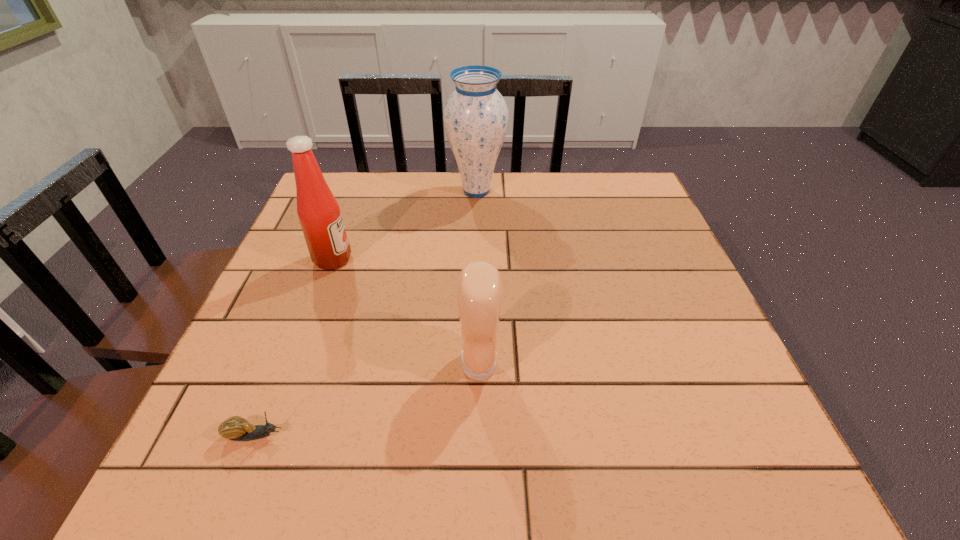
You are a GUI agent. You are given a task and a screenshot of the screen. Output one action in this format:
    pyautogui.click(x=<x>, y=<y>)
    Task: Click on the farthest object
    
    Given the screenshot: What is the action you would take?
    pyautogui.click(x=476, y=117)

At what (x,y) coordinates should I click in order to perform the action: click on the farther condiment. Please return your answer as a coordinate pair (x, y). The image size is (960, 540). Looking at the image, I should click on (319, 214).

The height and width of the screenshot is (540, 960). Identify the location of the taller condiment. (319, 214).

Where is `the third tallest object`? The image size is (960, 540). the third tallest object is located at coordinates (479, 291).

What are the coordinates of `the nearer condiment` in the screenshot? It's located at (479, 291).

The width and height of the screenshot is (960, 540). I want to click on the nearest object, so click(235, 428).

Identify the location of the shortest object. click(x=235, y=428).

Find the location of a particular element. blank space located 0.100m on the front of the farthest object is located at coordinates (476, 230).

Identify the location of free location located 0.310m on the front-facing side of the farther condiment. (483, 260).

The width and height of the screenshot is (960, 540). Identify the location of free spot located on the label of the nearer condiment. (602, 365).